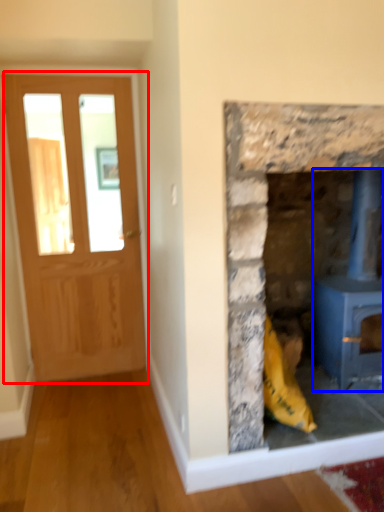
Question: Which object is further to the camera taking this photo, glass door (highlighted by a red box) or wood burning stove (highlighted by a blue box)?

Choices:
 (A) glass door
 (B) wood burning stove

Answer: (A)